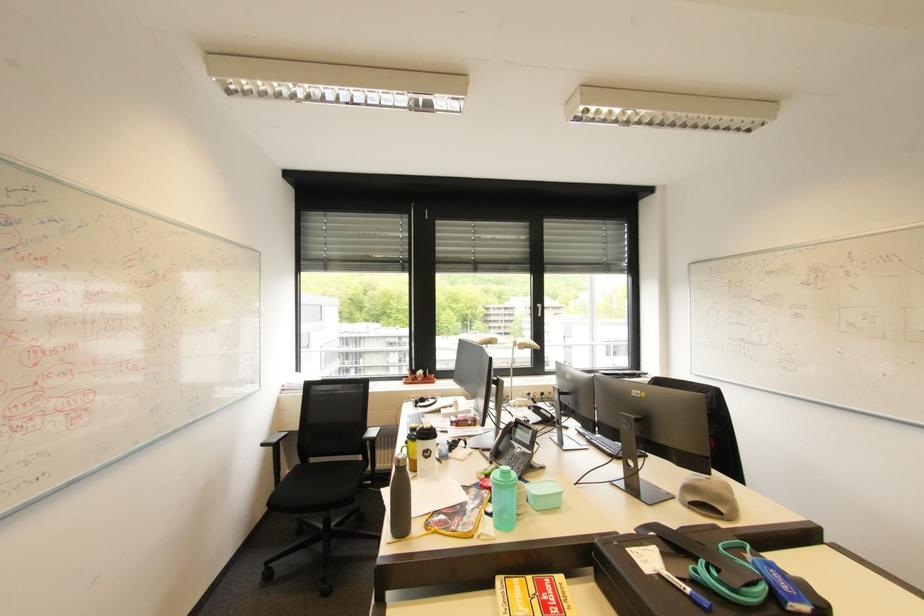
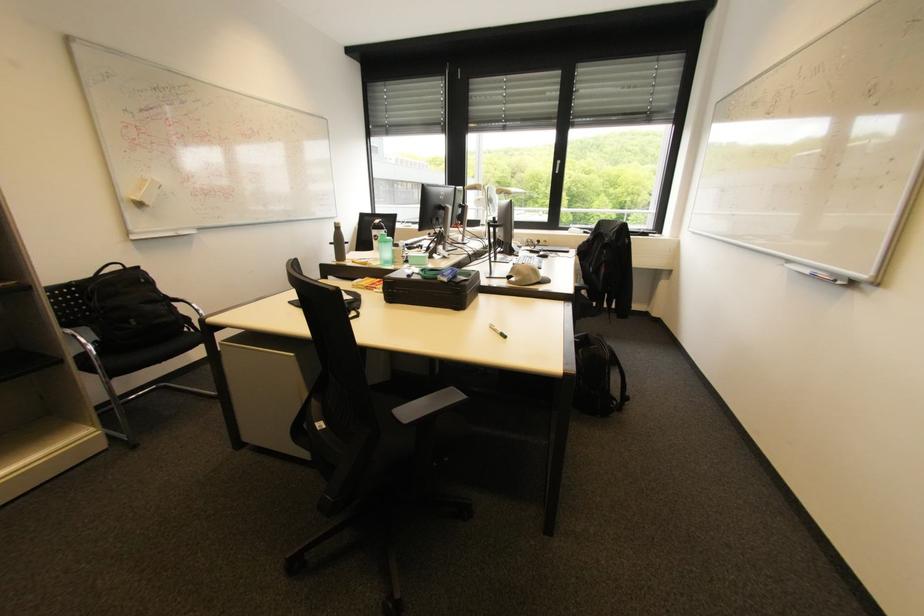
Locate, in the second image, the point that corresponds to point (723, 495) in the first image.

(524, 270)